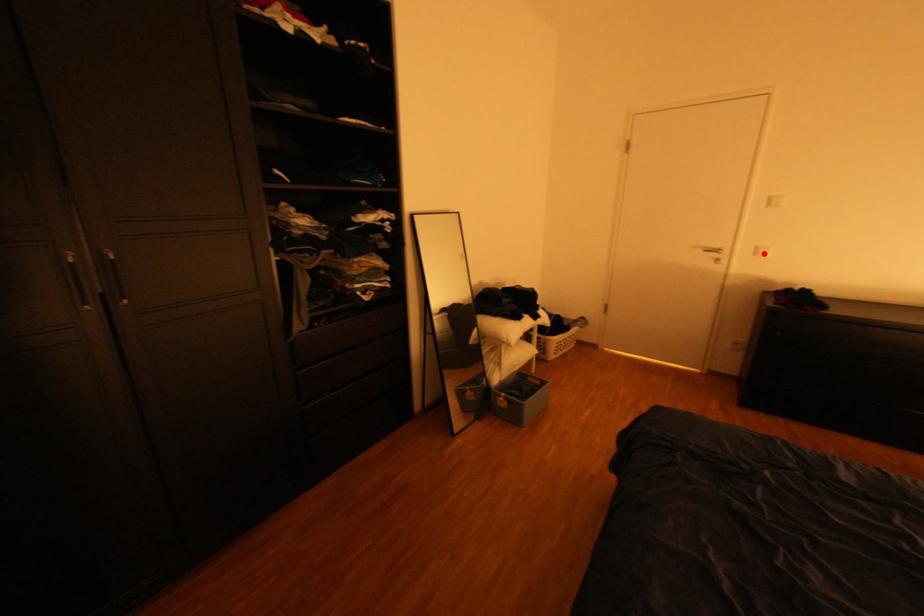
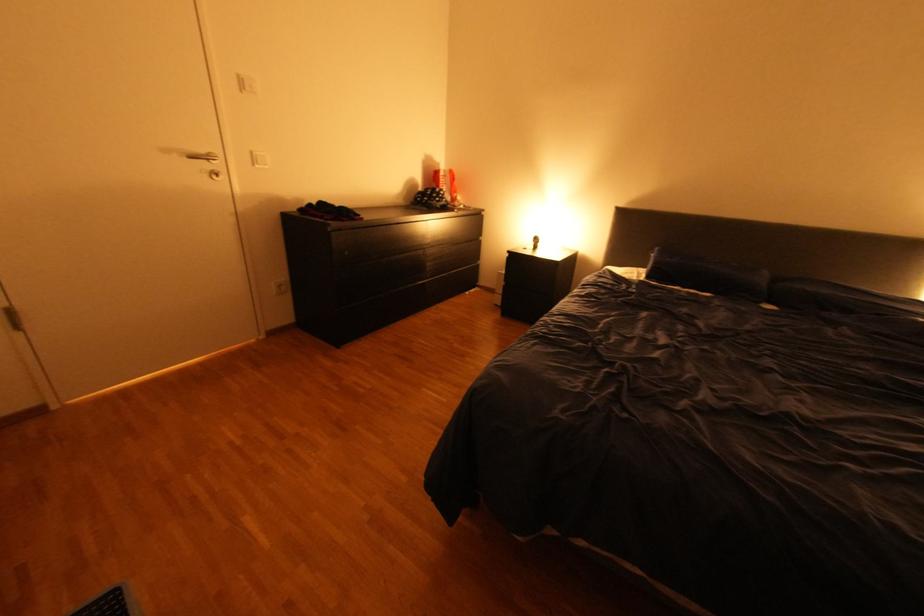
Where in the second image is the point corresponding to the highlighted location from the first image?

(264, 161)